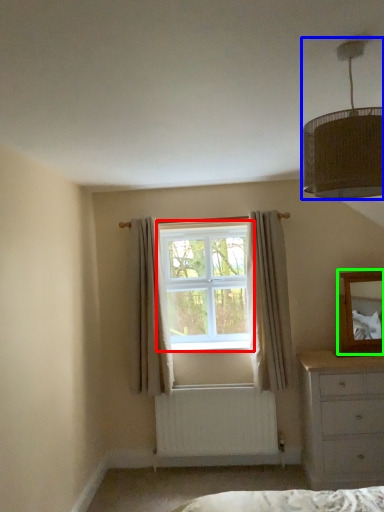
Question: Considering the real-world distances, which object is farthest from window (highlighted by a red box)? lamp (highlighted by a blue box) or mirror (highlighted by a green box)?

Choices:
 (A) lamp
 (B) mirror

Answer: (A)